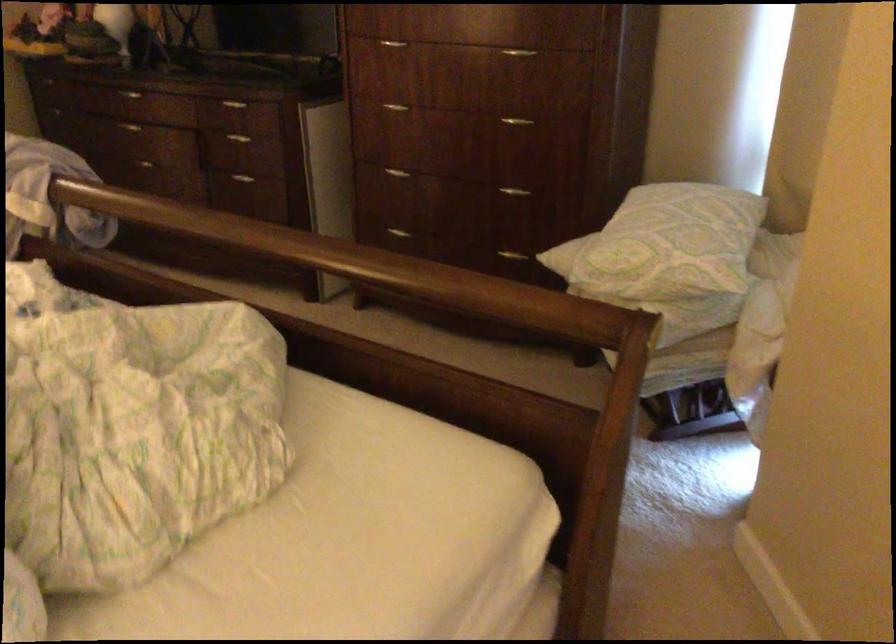
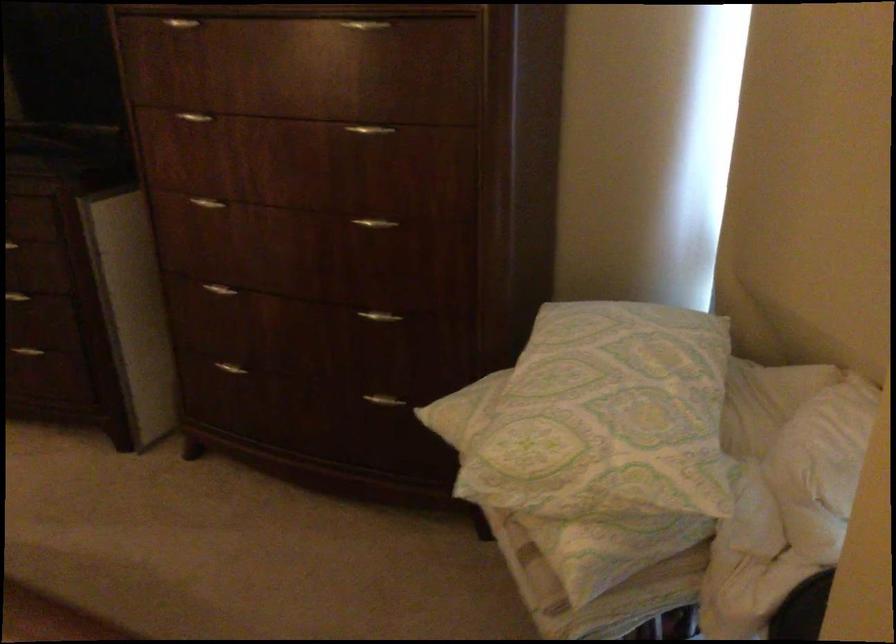
In the second image, find the point that corresponds to (514,118) in the first image.

(375, 223)